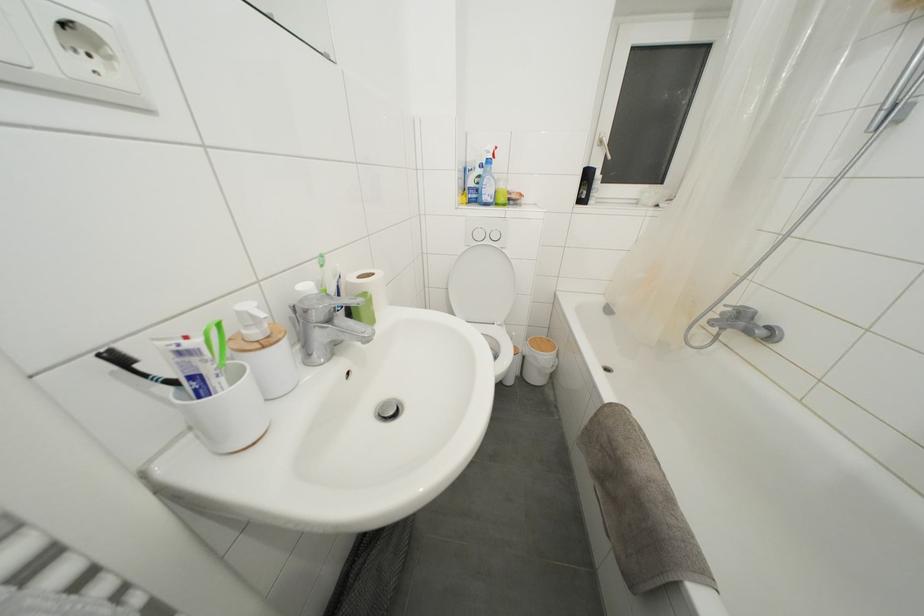
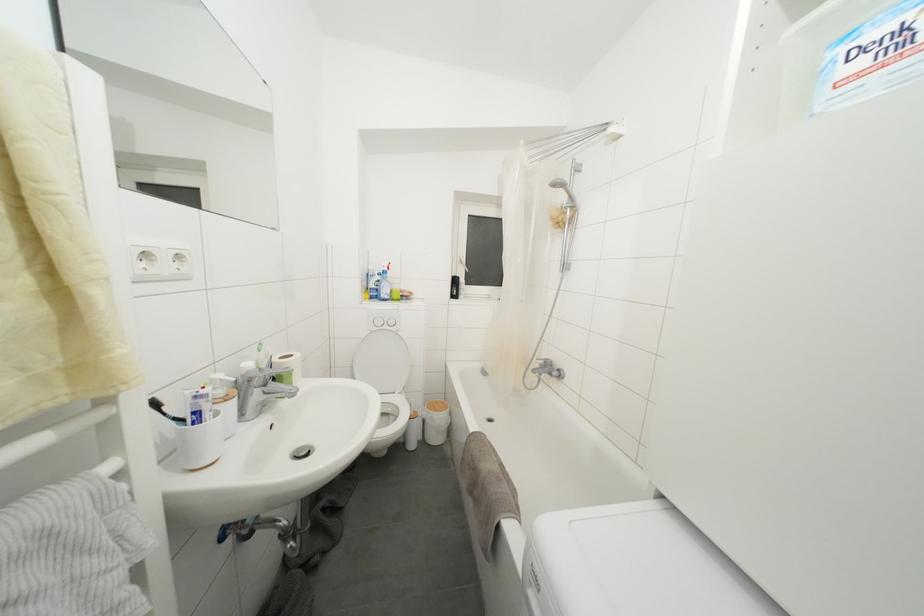
In the second image, find the point that corresponds to pixel 363 282 in the first image.

(285, 363)